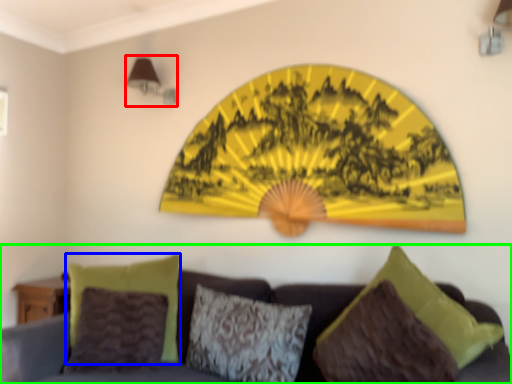
Question: Which object is positioned closest to lamp (highlighted by a red box)? Select from pillow (highlighted by a blue box) and studio couch (highlighted by a green box).

Choices:
 (A) pillow
 (B) studio couch

Answer: (A)